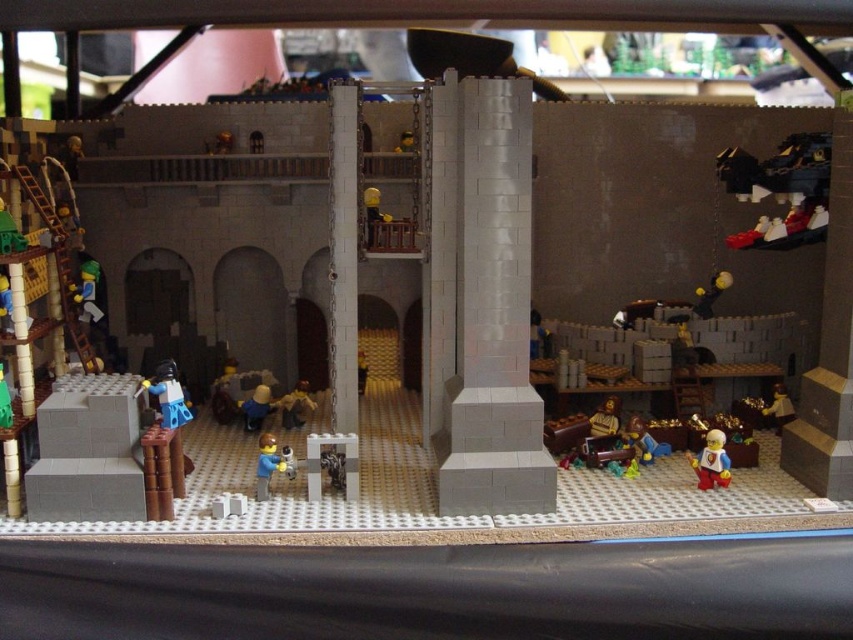
Question: Which point is closer to the camera?

Choices:
 (A) smooth brown figure at lower right
 (B) smooth gray bricks at center
 (C) smooth gold coin at center

Answer: (B)

Question: Among these objects, which one is nearest to the camera?

Choices:
 (A) matte black figure at center
 (B) light blue plastic figure at lower right

Answer: (A)

Question: Which object is farther from the camera taking this photo?

Choices:
 (A) smooth yellow helmet at upper center
 (B) blue plastic figure at center
 (C) blue matte figure at center
 (D) yellow matte ball at upper right

Answer: (D)

Question: Can you confirm if smooth gray column at center is bigger than smooth brown chest at lower right?

Choices:
 (A) no
 (B) yes

Answer: (B)

Question: Is the position of matte black figure at center more distant than that of smooth gold coin at center?

Choices:
 (A) yes
 (B) no

Answer: (B)

Question: Is white smooth pillar at center smaller than smooth brown figure at lower right?

Choices:
 (A) no
 (B) yes

Answer: (A)